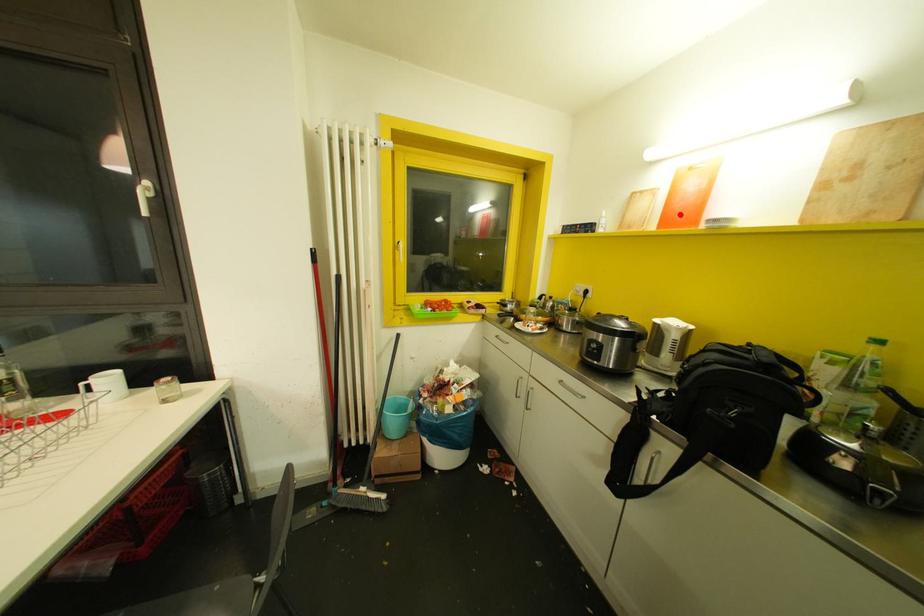
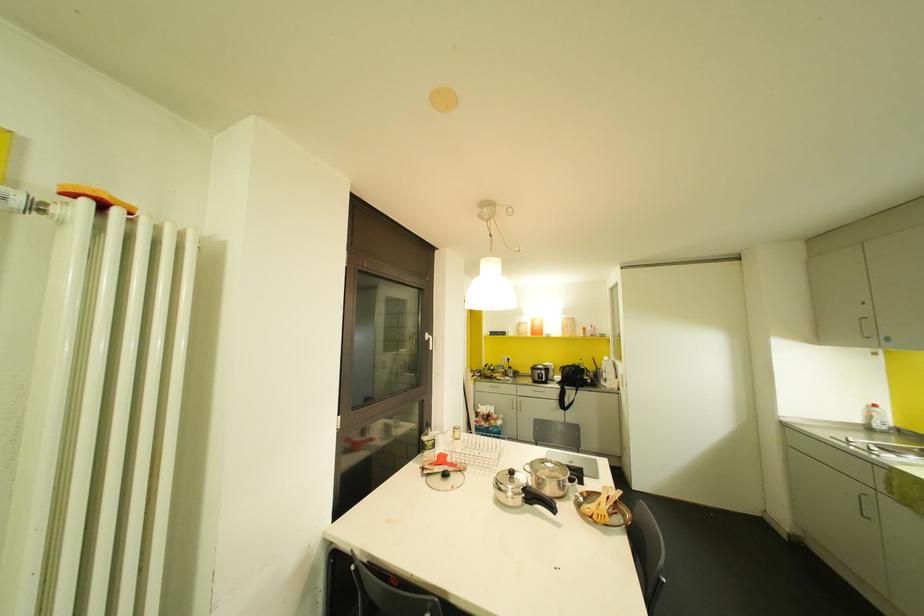
Find the pixel in the second image that matches the highlighted location in the first image.

(536, 331)